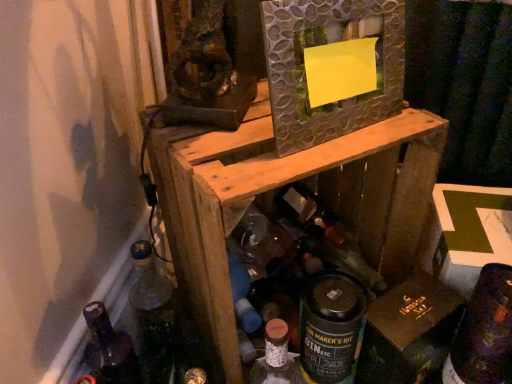
Find the location of a particular element. blank space to the left of textured silver mirror at center is located at coordinates (224, 144).